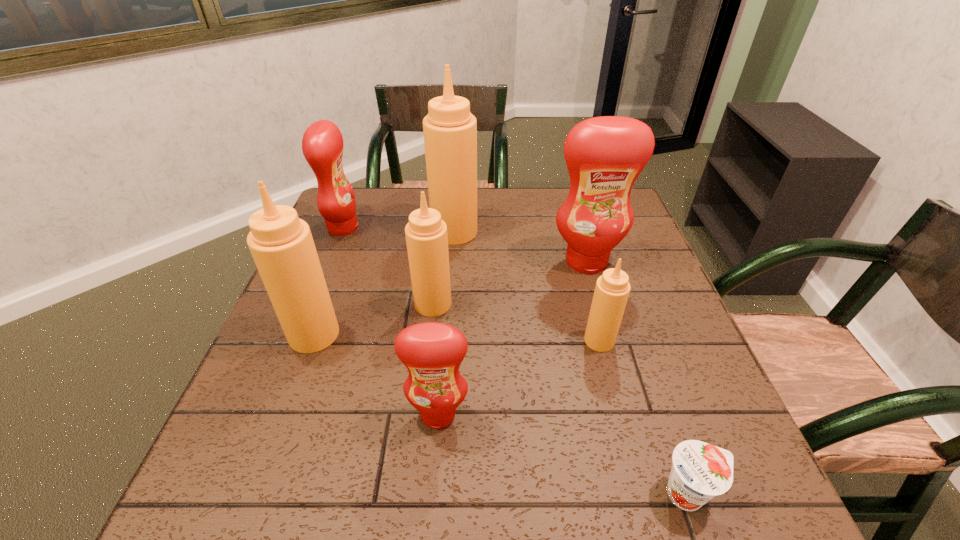
This screenshot has width=960, height=540. What are the coordinates of `vacant region between the smallest tan condiment and the biggest tan condiment` in the screenshot? It's located at (527, 286).

Image resolution: width=960 pixels, height=540 pixels. Find the location of `vacant region between the smallest red condiment and the rightmost tan condiment`. vacant region between the smallest red condiment and the rightmost tan condiment is located at coordinates (518, 377).

Locate an element on the screen. The image size is (960, 540). free space between the tallest condiment and the fifth nearest condiment is located at coordinates (520, 246).

Where is `free space between the third biggest tan condiment and the second nearest red condiment`? This screenshot has height=540, width=960. free space between the third biggest tan condiment and the second nearest red condiment is located at coordinates (510, 282).

Where is `unoccupied position between the third smallest tan condiment and the second smallest tan condiment`? The image size is (960, 540). unoccupied position between the third smallest tan condiment and the second smallest tan condiment is located at coordinates (373, 319).

Where is `unoccupied position between the third farthest condiment and the nearest red condiment`? The image size is (960, 540). unoccupied position between the third farthest condiment and the nearest red condiment is located at coordinates (513, 338).

Where is `vacant point located between the smallest tan condiment and the second nearest object`? The height and width of the screenshot is (540, 960). vacant point located between the smallest tan condiment and the second nearest object is located at coordinates (518, 377).

Locate an element on the screen. This screenshot has height=540, width=960. free spot between the nearest condiment and the second biggest tan condiment is located at coordinates (376, 374).

Identify which object is the fourth nearest to the nearest red condiment. Please provide its 2D coordinates. Your answer should be formatted as a tuple, i.e. [(x, y)], where the tuple contains the x and y coordinates of a point satisfying the conditions above.

[(700, 471)]

Locate which object ranks second in proximity to the nearest red condiment. Please provide its 2D coordinates. Your answer should be formatted as a tuple, i.e. [(x, y)], where the tuple contains the x and y coordinates of a point satisfying the conditions above.

[(426, 235)]